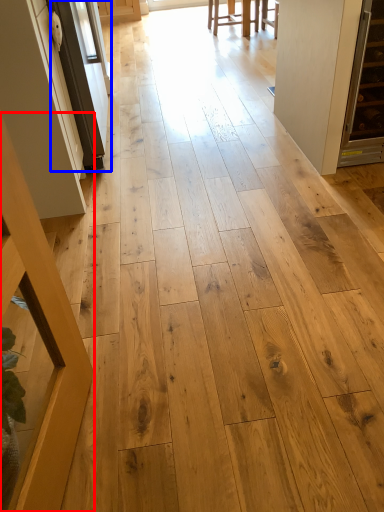
Question: Which object is closer to the camera taking this photo, furniture (highlighted by a red box) or screen door (highlighted by a blue box)?

Choices:
 (A) furniture
 (B) screen door

Answer: (A)